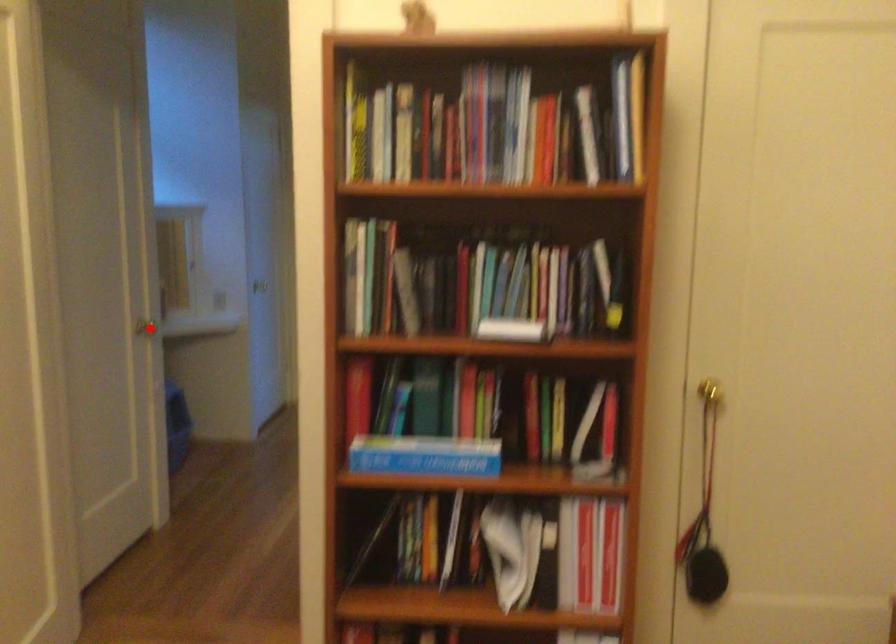
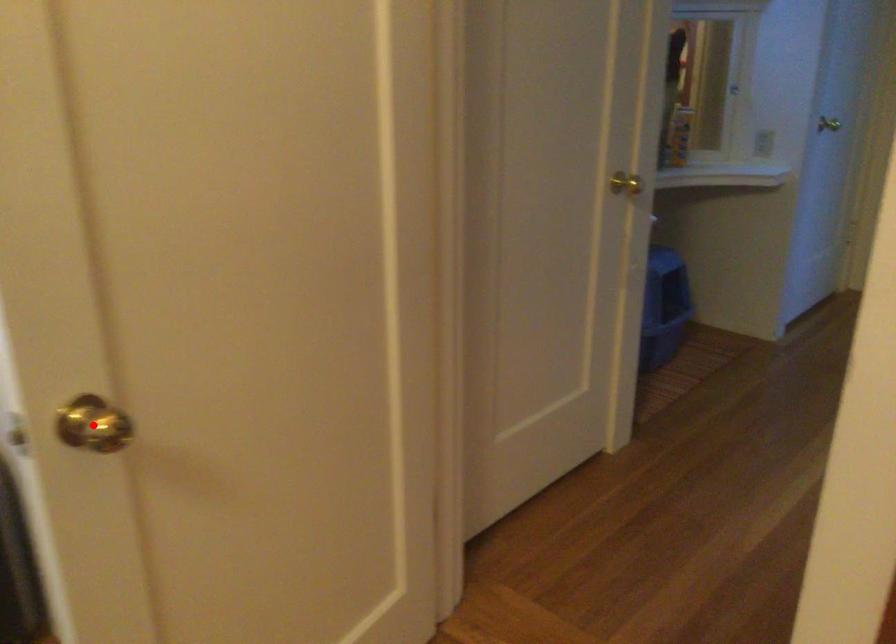
I am providing you with two images of the same scene from different viewpoints. A red point is marked on the first image and another point is marked on the second image. Is the red point in image1 aligned with the point shown in image2?

No